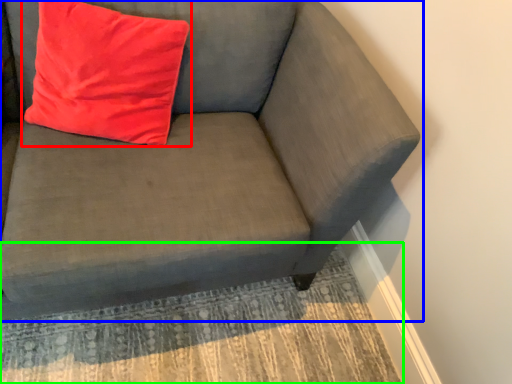
Question: Estimate the real-world distances between objects in this image. Which object is closer to pillow (highlighted by a red box), studio couch (highlighted by a blue box) or mat (highlighted by a green box)?

Choices:
 (A) studio couch
 (B) mat

Answer: (A)